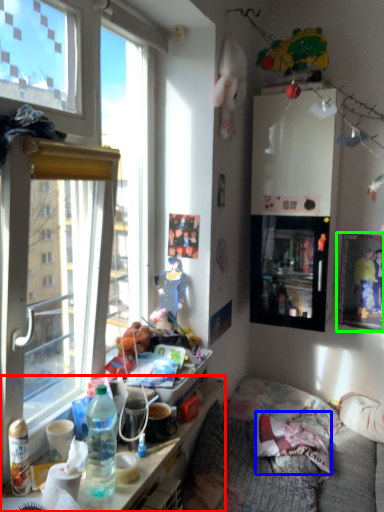
Question: Considering the real-world distances, which object is farthest from cabinetry (highlighted by a red box)? pillow (highlighted by a blue box) or picture frame (highlighted by a green box)?

Choices:
 (A) pillow
 (B) picture frame

Answer: (B)